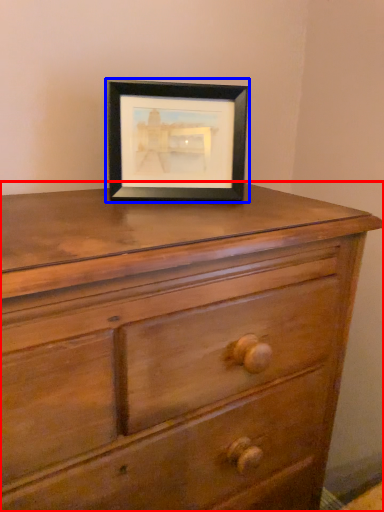
Question: Among these objects, which one is farthest to the camera, chest of drawers (highlighted by a red box) or picture frame (highlighted by a blue box)?

Choices:
 (A) chest of drawers
 (B) picture frame

Answer: (B)